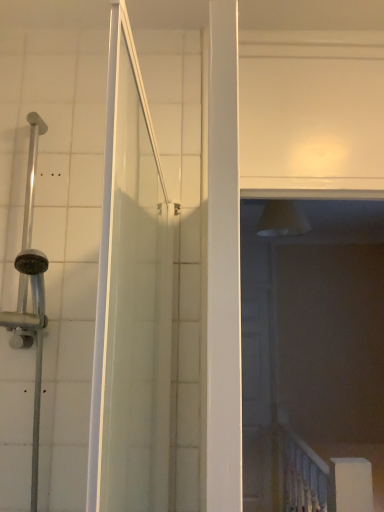
Describe the element at coordinates (302, 475) in the screenshot. The image size is (384, 512). I see `white glossy rail at lower right` at that location.

Where is `white glossy rail at lower right`? white glossy rail at lower right is located at coordinates (302, 475).

At what (x,y) coordinates should I click in order to perform the action: click on transparent plastic screen door at center. Please return your answer as a coordinate pair (x, y). The height and width of the screenshot is (512, 384). Looking at the image, I should click on (259, 368).

What do you see at coordinates (259, 368) in the screenshot?
I see `transparent plastic screen door at center` at bounding box center [259, 368].

Locate an element on the screen. Image resolution: width=384 pixels, height=512 pixels. white glossy rail at lower right is located at coordinates (302, 475).

Can you confirm if white glossy rail at lower right is positioned to the left of transparent plastic screen door at center?

In fact, white glossy rail at lower right is to the right of transparent plastic screen door at center.

Is white glossy rail at lower right in front of transparent plastic screen door at center?

Yes, white glossy rail at lower right is in front of transparent plastic screen door at center.

Does point (326, 506) lie in front of point (253, 370)?

Yes.

From the image's perspective, would you say white glossy rail at lower right is shown under transparent plastic screen door at center?

Yes, from the image's perspective, white glossy rail at lower right is beneath transparent plastic screen door at center.

From a real-world perspective, is white glossy rail at lower right on transparent plastic screen door at center?

No, from a real-world perspective, white glossy rail at lower right is not over transparent plastic screen door at center

Can you confirm if white glossy rail at lower right is wider than transparent plastic screen door at center?

Yes, white glossy rail at lower right is wider than transparent plastic screen door at center.

Who is shorter, white glossy rail at lower right or transparent plastic screen door at center?

white glossy rail at lower right is shorter.

Considering the relative sizes of white glossy rail at lower right and transparent plastic screen door at center in the image provided, is white glossy rail at lower right smaller than transparent plastic screen door at center?

Incorrect, white glossy rail at lower right is not smaller in size than transparent plastic screen door at center.

Do you think white glossy rail at lower right is within transparent plastic screen door at center, or outside of it?

white glossy rail at lower right lies outside transparent plastic screen door at center.

Is white glossy rail at lower right with transparent plastic screen door at center?

No, white glossy rail at lower right is not beside transparent plastic screen door at center.

Could you tell me if white glossy rail at lower right is facing transparent plastic screen door at center?

No, white glossy rail at lower right is not turned towards transparent plastic screen door at center.

How different are the orientations of white glossy rail at lower right and transparent plastic screen door at center in degrees?

The facing directions of white glossy rail at lower right and transparent plastic screen door at center are 90 degrees apart.

Where is `rail in front of the transparent plastic screen door at center`? rail in front of the transparent plastic screen door at center is located at coordinates (302, 475).

Considering the positions of objects transparent plastic screen door at center and white glossy rail at lower right in the image provided, who is more to the right, transparent plastic screen door at center or white glossy rail at lower right?

white glossy rail at lower right.

Which object is further away from the camera, transparent plastic screen door at center or white glossy rail at lower right?

transparent plastic screen door at center is behind.

Is point (269, 347) in front of point (310, 504)?

No, (269, 347) is further to viewer.

From the image's perspective, is transparent plastic screen door at center positioned above or below white glossy rail at lower right?

Based on their image positions, transparent plastic screen door at center is located above white glossy rail at lower right.

From a real-world perspective, is transparent plastic screen door at center under white glossy rail at lower right?

Actually, transparent plastic screen door at center is physically above white glossy rail at lower right in the real world.

Which object is wider, transparent plastic screen door at center or white glossy rail at lower right?

With larger width is white glossy rail at lower right.

Considering the relative sizes of transparent plastic screen door at center and white glossy rail at lower right in the image provided, is transparent plastic screen door at center shorter than white glossy rail at lower right?

No.

Which of these two, transparent plastic screen door at center or white glossy rail at lower right, is bigger?

With larger size is white glossy rail at lower right.

Is white glossy rail at lower right inside transparent plastic screen door at center?

No, white glossy rail at lower right is not a part of transparent plastic screen door at center.

Is the surface of transparent plastic screen door at center in direct contact with white glossy rail at lower right?

No, transparent plastic screen door at center is not touching white glossy rail at lower right.

Is transparent plastic screen door at center oriented towards white glossy rail at lower right?

Yes, transparent plastic screen door at center is aimed at white glossy rail at lower right.

Can you tell me how much transparent plastic screen door at center and white glossy rail at lower right differ in facing direction?

90 degrees separate the facing orientations of transparent plastic screen door at center and white glossy rail at lower right.

Where is `rail located below the transparent plastic screen door at center (from the image's perspective)`? The height and width of the screenshot is (512, 384). rail located below the transparent plastic screen door at center (from the image's perspective) is located at coordinates (302, 475).

Where is `rail lying on the right of transparent plastic screen door at center`? This screenshot has height=512, width=384. rail lying on the right of transparent plastic screen door at center is located at coordinates (302, 475).

The width and height of the screenshot is (384, 512). I want to click on screen door on the left side of white glossy rail at lower right, so click(x=259, y=368).